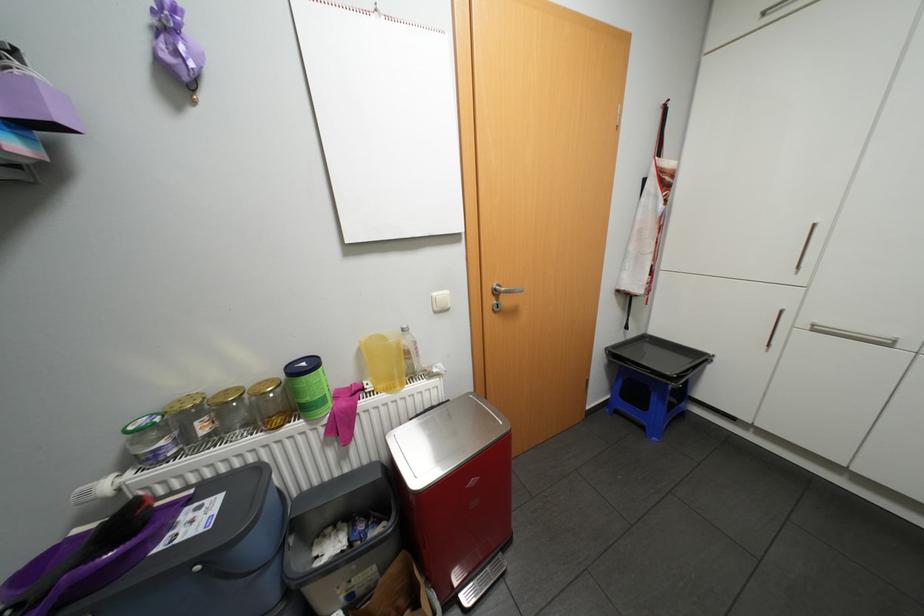
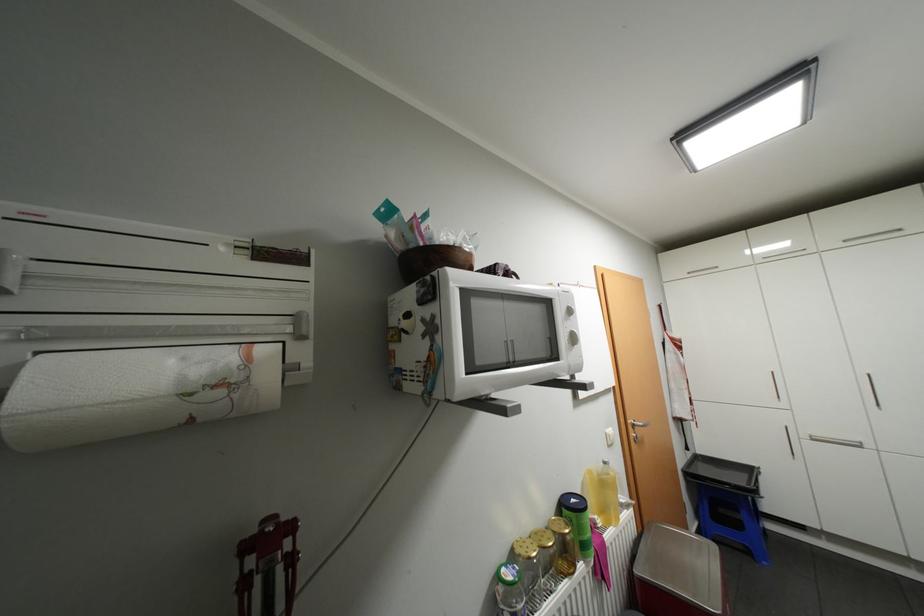
Find the pixel in the second image that matches pixel 311 363 in the first image.

(580, 499)